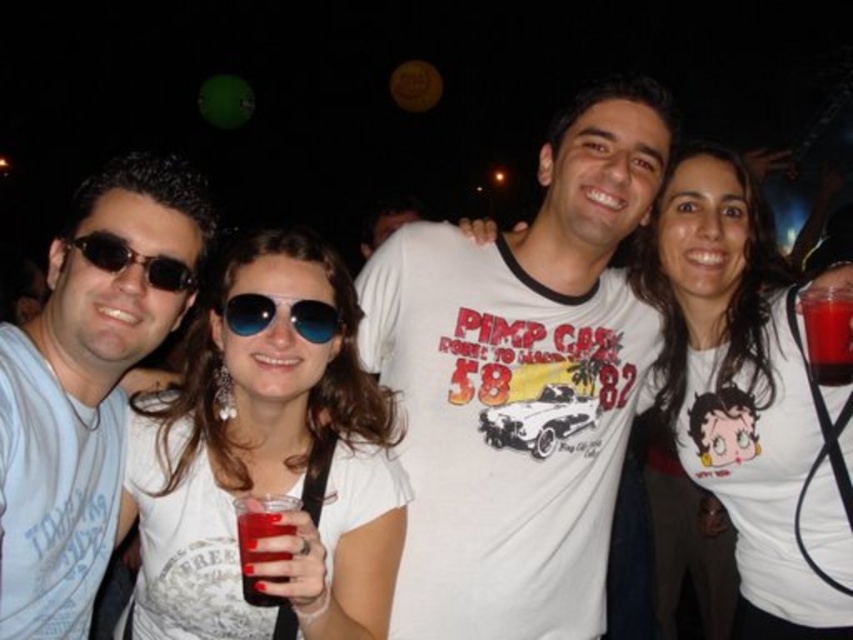
Can you confirm if white matte t-shirt at center is wider than blue reflective sunglasses at center?

Yes.

Which is above, white matte t-shirt at center or blue reflective sunglasses at center?

blue reflective sunglasses at center is higher up.

Identify the location of white matte t-shirt at center. This screenshot has width=853, height=640. [747, 397].

Can you confirm if white cotton t-shirt at center is smaller than white matte sunglasses at center?

No, white cotton t-shirt at center is not smaller than white matte sunglasses at center.

The height and width of the screenshot is (640, 853). I want to click on white cotton t-shirt at center, so click(x=520, y=384).

Is the position of white cotton t-shirt at center more distant than that of matte white t-shirt at left?

Yes, it is behind matte white t-shirt at left.

Who is positioned more to the right, white cotton t-shirt at center or matte white t-shirt at left?

From the viewer's perspective, white cotton t-shirt at center appears more on the right side.

The height and width of the screenshot is (640, 853). What do you see at coordinates (520, 384) in the screenshot?
I see `white cotton t-shirt at center` at bounding box center [520, 384].

This screenshot has width=853, height=640. I want to click on white cotton t-shirt at center, so click(x=520, y=384).